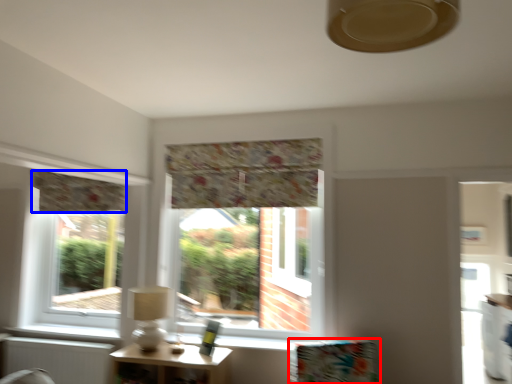
Question: Which point is further to the camera, furniture (highlighted by a red box) or curtain (highlighted by a blue box)?

Choices:
 (A) furniture
 (B) curtain

Answer: (B)